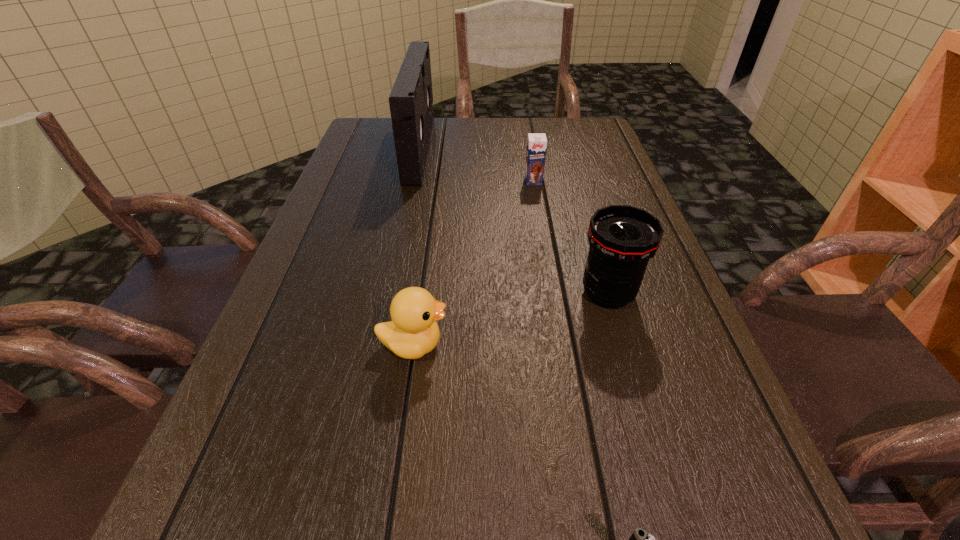
The image size is (960, 540). What are the coordinates of `object located in the right edge section of the desktop` in the screenshot? It's located at (622, 238).

You are a GUI agent. You are given a task and a screenshot of the screen. Output one action in this format:
    pyautogui.click(x=<x>, y=<y>)
    Task: Click on the free space at the left edge of the desktop
    The width and height of the screenshot is (960, 540).
    Given the screenshot: What is the action you would take?
    pyautogui.click(x=370, y=279)

This screenshot has height=540, width=960. In the image, there is a desktop. In order to click on vacant space at the right edge in this screenshot , I will do `click(637, 432)`.

Where is `vacant space at the far left corner of the desktop`? Image resolution: width=960 pixels, height=540 pixels. vacant space at the far left corner of the desktop is located at coordinates (373, 132).

Where is `vacant region between the fourth shortest object and the second nearest object`? The width and height of the screenshot is (960, 540). vacant region between the fourth shortest object and the second nearest object is located at coordinates (511, 319).

What are the coordinates of `free space between the fourth farthest object and the chocolate milk` in the screenshot? It's located at (473, 262).

This screenshot has width=960, height=540. I want to click on free space between the videotape and the third object from left to right, so click(476, 165).

The height and width of the screenshot is (540, 960). I want to click on vacant region between the duck and the videotape, so click(x=417, y=247).

You are a GUI agent. You are given a task and a screenshot of the screen. Output one action in this format:
    pyautogui.click(x=<x>, y=<y>)
    Task: Click on the free space between the chocolate milk and the second tallest object
    The height and width of the screenshot is (540, 960).
    Given the screenshot: What is the action you would take?
    pyautogui.click(x=571, y=238)

Identify the location of empty space between the chocolate milk and the telephoto lens. (571, 238).